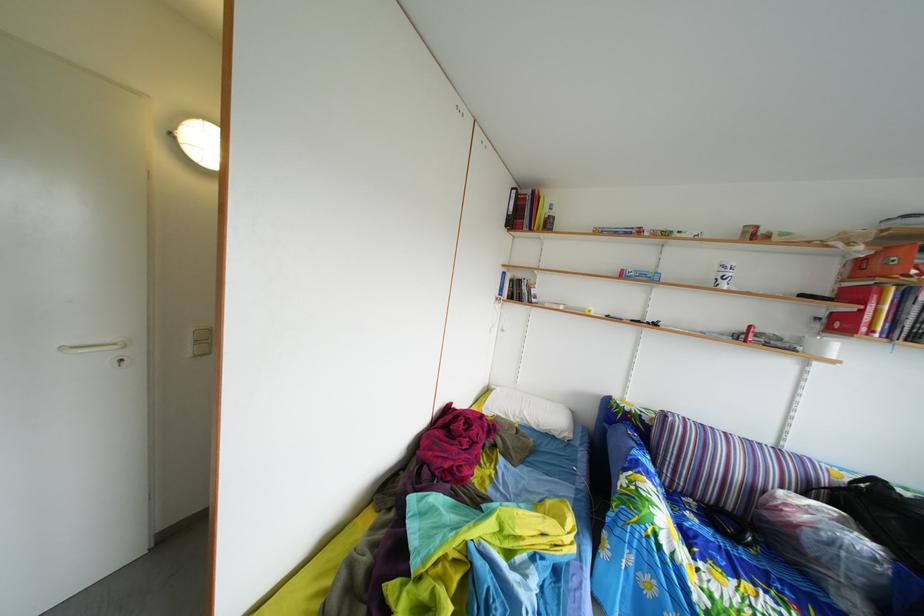
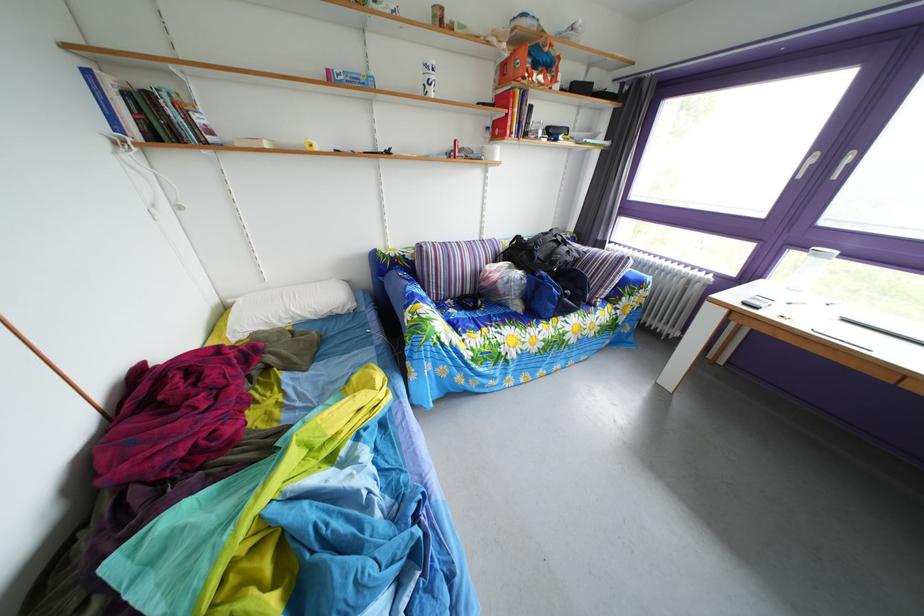
Find the pixel in the second image that matches [699,524] in the first image.

(463, 320)